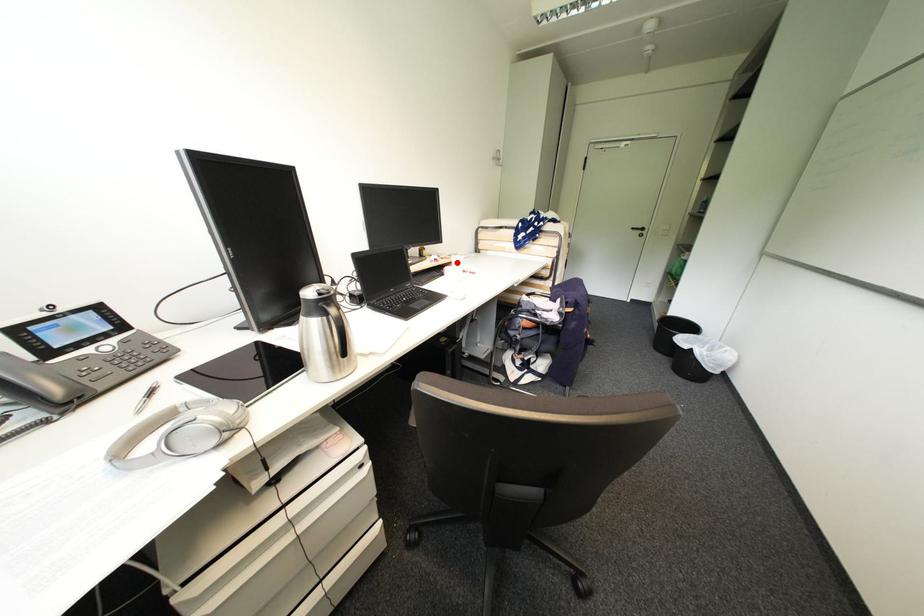
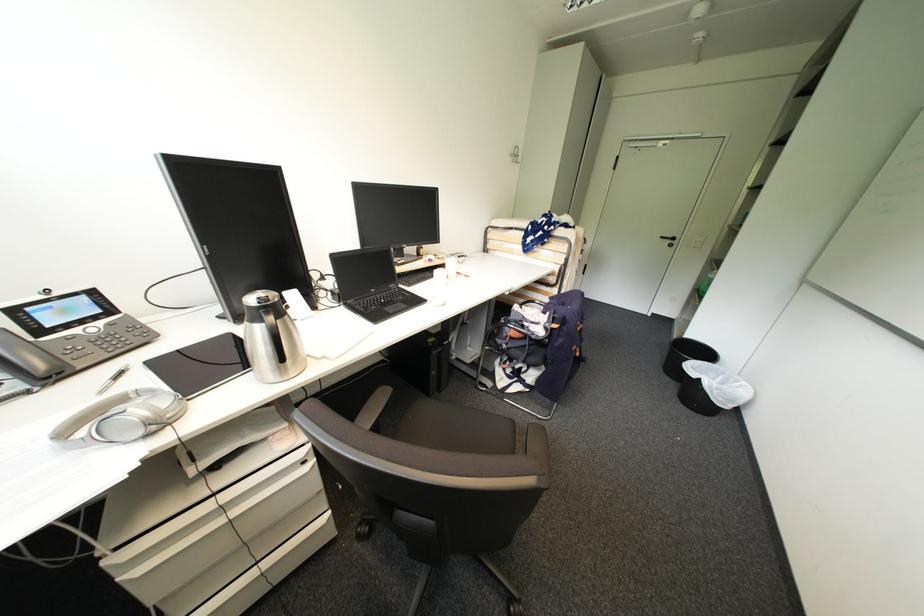
Where in the second image is the point corresponding to the highlighted location from the first image?

(451, 264)